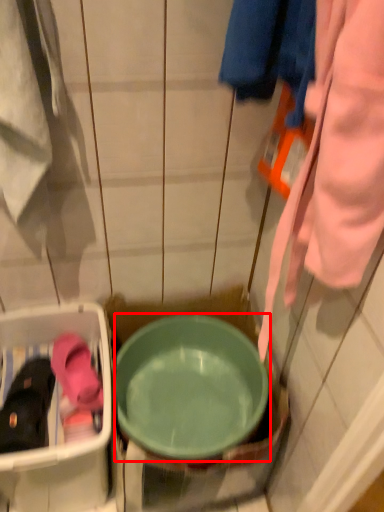
Question: From the image, what is the correct spatial relationship of basin (annotated by the red box) in relation to footwear?

Choices:
 (A) right
 (B) left

Answer: (A)